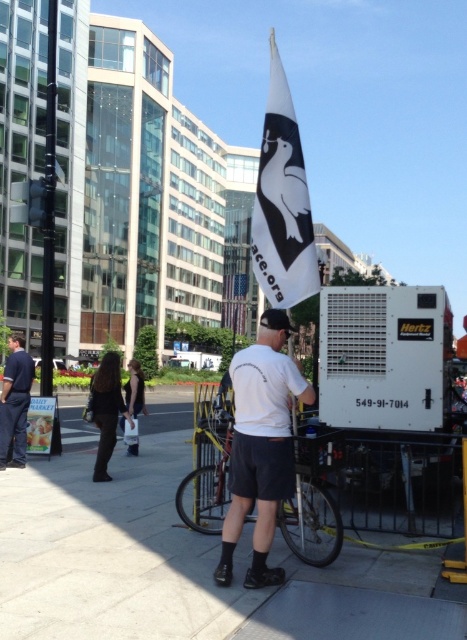
Between white cotton t-shirt at center and black fabric bag at center, which one is positioned higher?

white cotton t-shirt at center

Can you confirm if white cotton t-shirt at center is positioned below black fabric bag at center?

No, white cotton t-shirt at center is not below black fabric bag at center.

Who is more distant from viewer, (x=269, y=332) or (x=141, y=403)?

The point (x=141, y=403) is behind.

Where is `white cotton t-shirt at center`? The image size is (467, 640). white cotton t-shirt at center is located at coordinates (261, 445).

Does smooth concrete sidewalk at center appear on the right side of black fabric bag at center?

Indeed, smooth concrete sidewalk at center is positioned on the right side of black fabric bag at center.

Who is higher up, smooth concrete sidewalk at center or black fabric bag at center?

black fabric bag at center is higher up.

Describe the element at coordinates (181, 563) in the screenshot. The height and width of the screenshot is (640, 467). I see `smooth concrete sidewalk at center` at that location.

Locate an element on the screen. The height and width of the screenshot is (640, 467). smooth concrete sidewalk at center is located at coordinates (181, 563).

The width and height of the screenshot is (467, 640). What do you see at coordinates (283, 202) in the screenshot? I see `white fabric flag at upper center` at bounding box center [283, 202].

Does white fabric flag at upper center have a greater height compared to black fabric bag at center?

Yes, white fabric flag at upper center is taller than black fabric bag at center.

Does point (269, 161) come in front of point (141, 412)?

That is True.

This screenshot has width=467, height=640. Identify the location of white fabric flag at upper center. tap(283, 202).